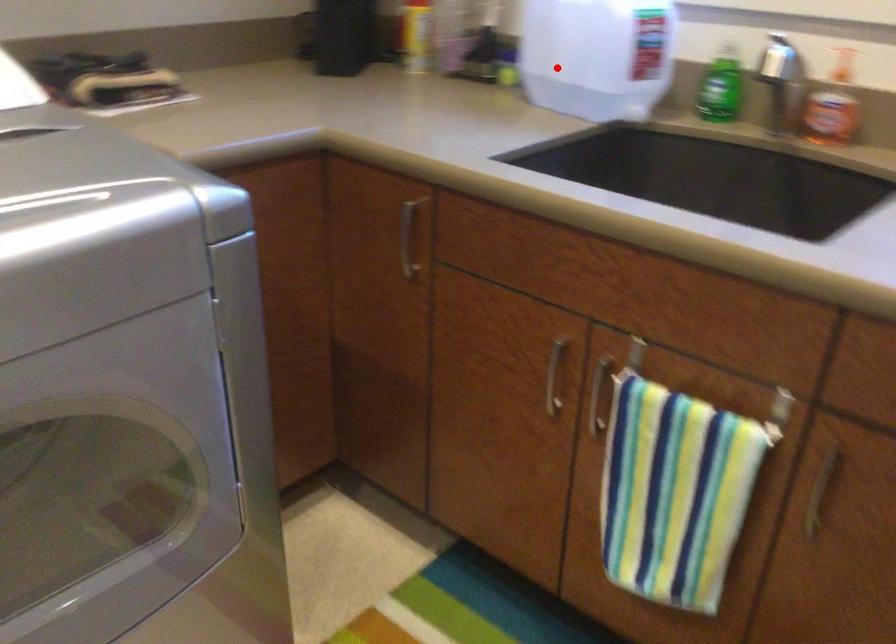
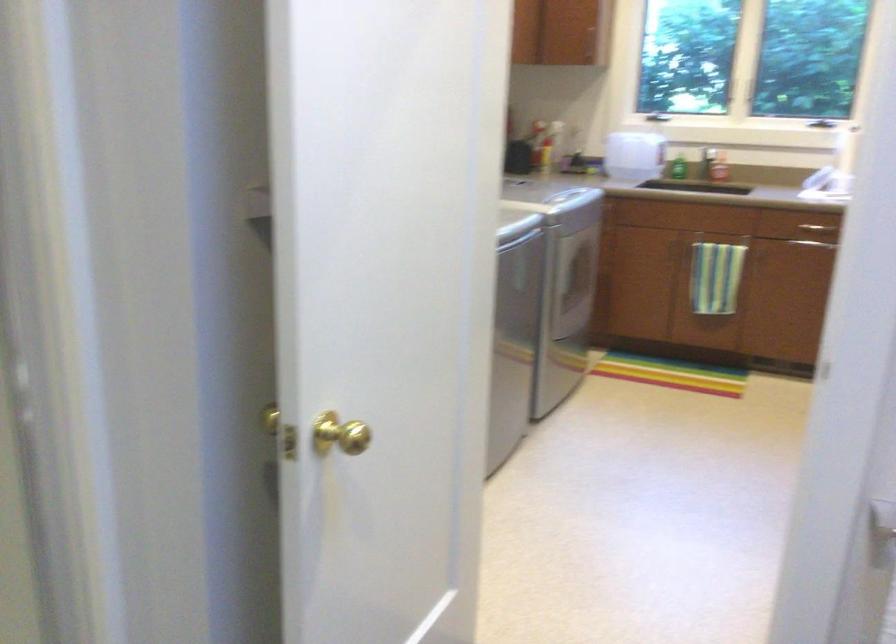
Where in the second image is the point corresponding to the highlighted location from the first image?

(633, 155)